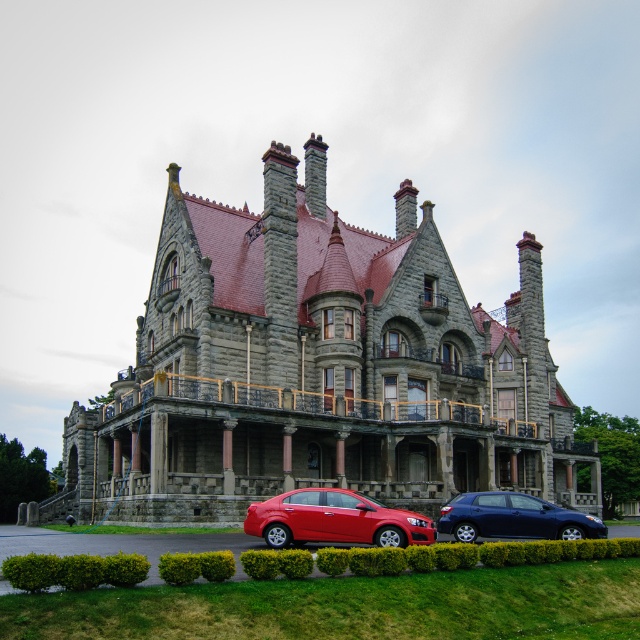
You are standing in front of the Victorian mansion and notice two points marked on the building. The first point is at coordinate point [204,468] and the second is at point [582,589]. Which point is closer to you?

Point [204,468] is closer to you because it is further to the viewer than point [582,589].

You are standing in front of the Victorian mansion and see the green grass at lower center and the metallic blue hatchback at lower center. Which object is closer to the ground?

The green grass at lower center is located below metallic blue hatchback at lower center, so it is closer to the ground.